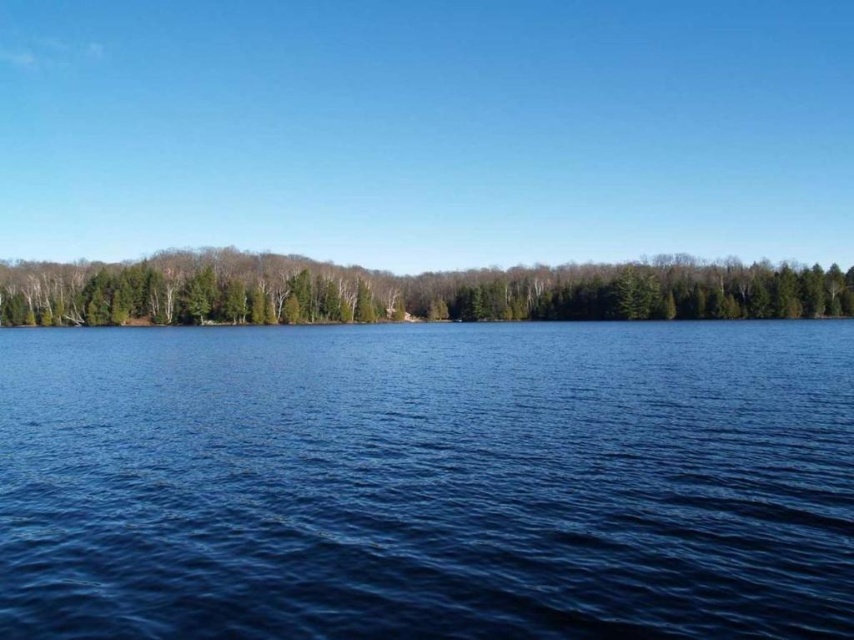
You are a photographer planning to capture the reflection of the green matte trees at center in the deep blue water at center. Based on the scene description, will the reflection be clearly visible?

The deep blue water at center is positioned under green matte trees at center, so the reflection of the green matte trees at center in the deep blue water at center should be clearly visible since the water is calm and reflective as described in the scene.

You are a photographer planning to capture the deep blue water at center and the green matte trees at center in a single shot. Given that your camera can only focus on one object at a time, which object should you prioritize focusing on to ensure the smaller one is in sharp focus?

The deep blue water at center has a smaller size compared to green matte trees at center, so you should prioritize focusing on the deep blue water at center to ensure it is in sharp focus.